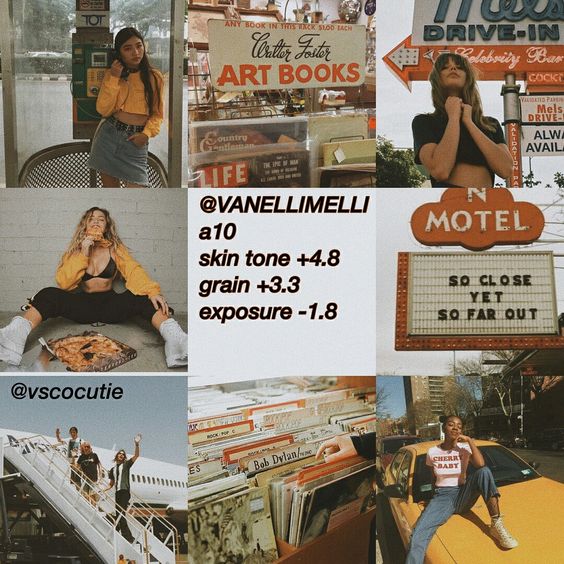
Find the location of `pictures`. pictures is located at coordinates 155,147, 237,152, 394,124, 135,214, 416,254, 139,402, 408,415.